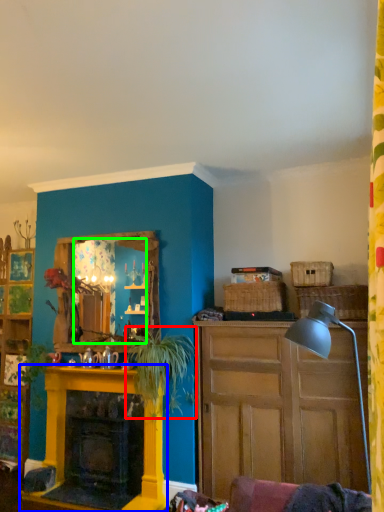
Question: Which object is the farthest from plant (highlighted by a red box)? Choose among these: fireplace (highlighted by a blue box) or mirror (highlighted by a green box).

Choices:
 (A) fireplace
 (B) mirror

Answer: (A)